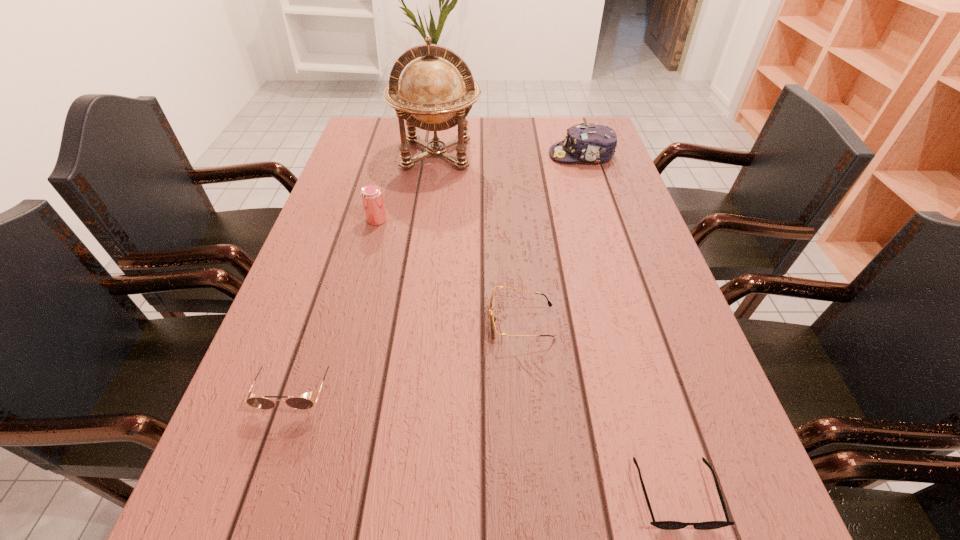
Image resolution: width=960 pixels, height=540 pixels. What are the coordinates of `free space at the far left corner of the desktop` in the screenshot? It's located at (393, 148).

Image resolution: width=960 pixels, height=540 pixels. In the image, there is a desktop. What are the coordinates of `blank space at the far right corner` in the screenshot? It's located at (590, 118).

This screenshot has width=960, height=540. In order to click on vacant region between the shortest object and the second sunglasses from left to right in this screenshot , I will do `click(599, 408)`.

Locate an element on the screen. The height and width of the screenshot is (540, 960). vacant space in between the rightmost sunglasses and the second sunglasses from left to right is located at coordinates (599, 408).

I want to click on free point between the third farthest object and the second shortest sunglasses, so click(x=449, y=271).

The image size is (960, 540). In order to click on vacant space in between the headwear and the shortest object in this screenshot , I will do point(629,324).

Where is `free space between the second sunglasses from left to right and the headwear`? The width and height of the screenshot is (960, 540). free space between the second sunglasses from left to right and the headwear is located at coordinates (552, 239).

Locate an element on the screen. unoccupied area between the headwear and the fifth tallest object is located at coordinates [x=552, y=239].

Where is `empty location between the nearest sunglasses and the headwear`? empty location between the nearest sunglasses and the headwear is located at coordinates (629, 324).

Identify the location of free spot between the nearest sunglasses and the third farthest object. (x=526, y=356).